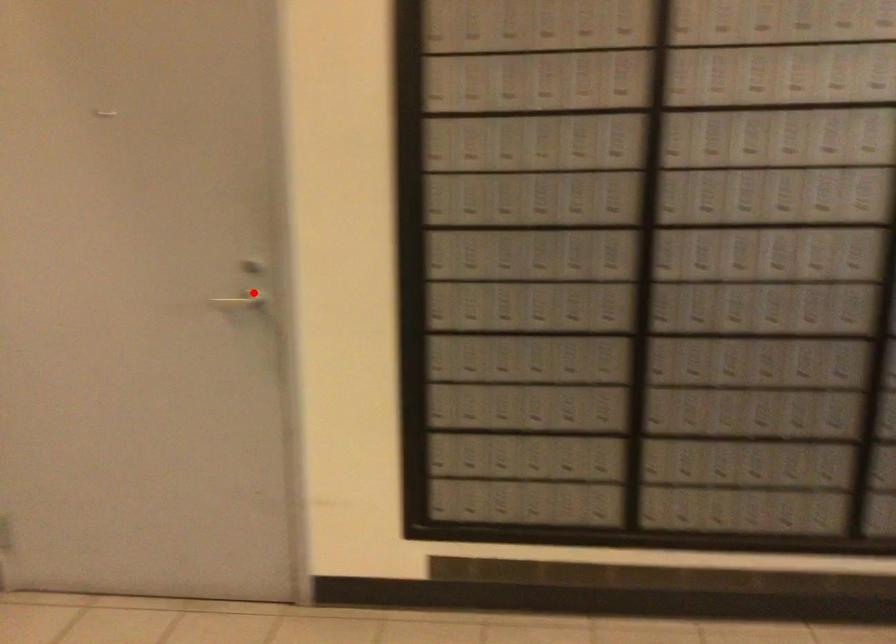
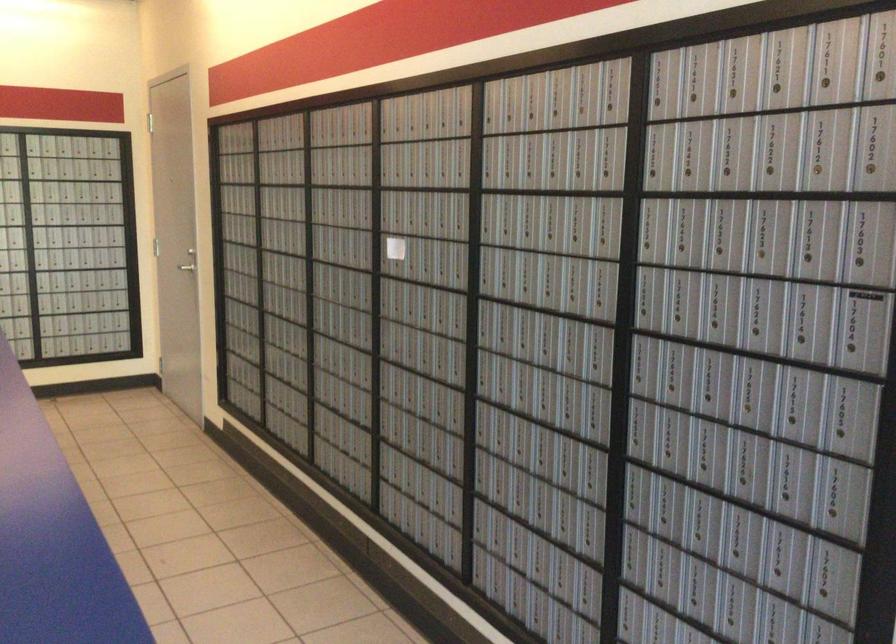
Question: I am providing you with two images of the same scene from different viewpoints. A red point is shown in image1. For the corresponding object point in image2, is it positioned nearer or farther from the camera?

Choices:
 (A) Nearer
 (B) Farther

Answer: (B)